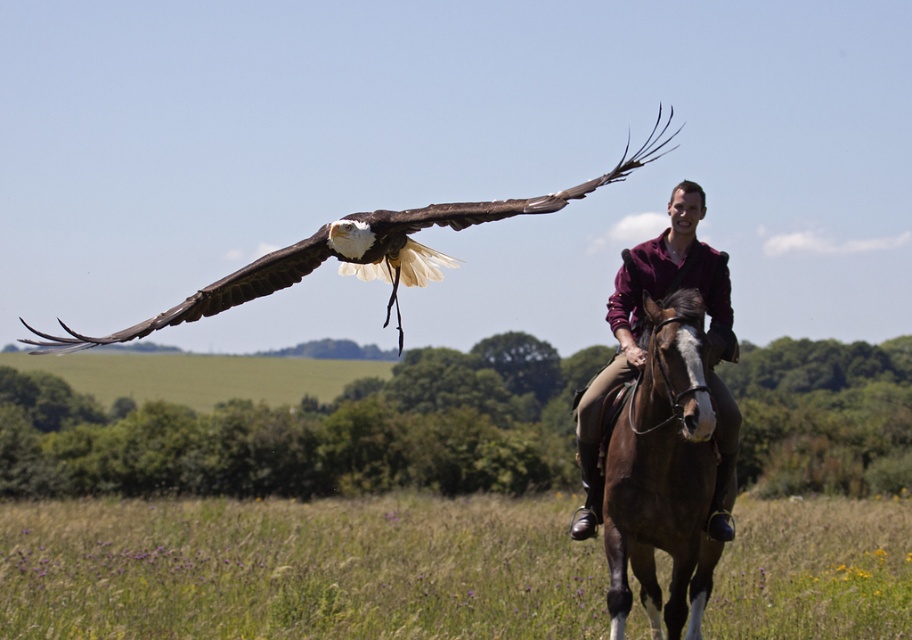
You are a photographer trying to capture a photo of the maroon shirt at center and the brown feathered eagle at upper left. From the photographer viewpoint, which object is positioned to the right side?

The brown feathered eagle at upper left is positioned to the right of the maroon shirt at center, so the eagle is to the right side.

You are an observer standing in the field. You notice the brown glossy horse at center and the maroon shirt at center. Which object appears wider from your perspective?

The maroon shirt at center appears wider than the brown glossy horse at center since the horse has a lesser width compared to the shirt.